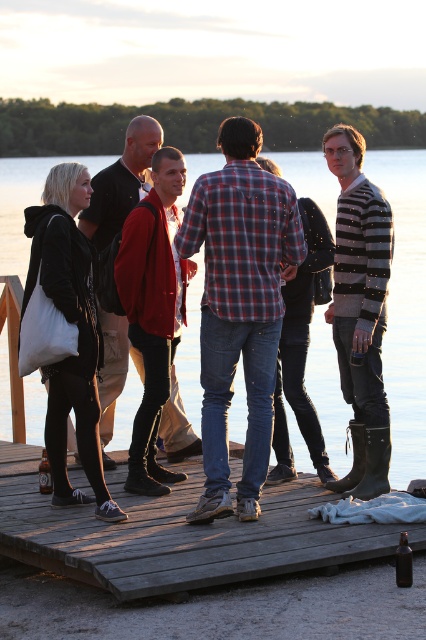
You are trying to place a small bench on the wooden dock at center so that it doesn not block the view of the plaid fabric shirt at center. Based on their widths, will the bench fit on the dock without overlapping the shirt?

The wooden dock at center might be wider than plaid fabric shirt at center, so there is a possibility that the bench can be placed on the dock without overlapping the shirt, but there is uncertainty due to the comparative width not being definitively stated.

You are a photographer trying to capture a photo of the group on the dock. You want to ensure both the matte black jacket at left and the red sweater at center are visible in the frame. Based on their positions, which direction should you position yourself relative to the group to include both in the shot?

Since the matte black jacket at left is to the left of the red sweater at center, positioning yourself to the left of the group will ensure both the matte black jacket at left and the red sweater at center are included in the frame.